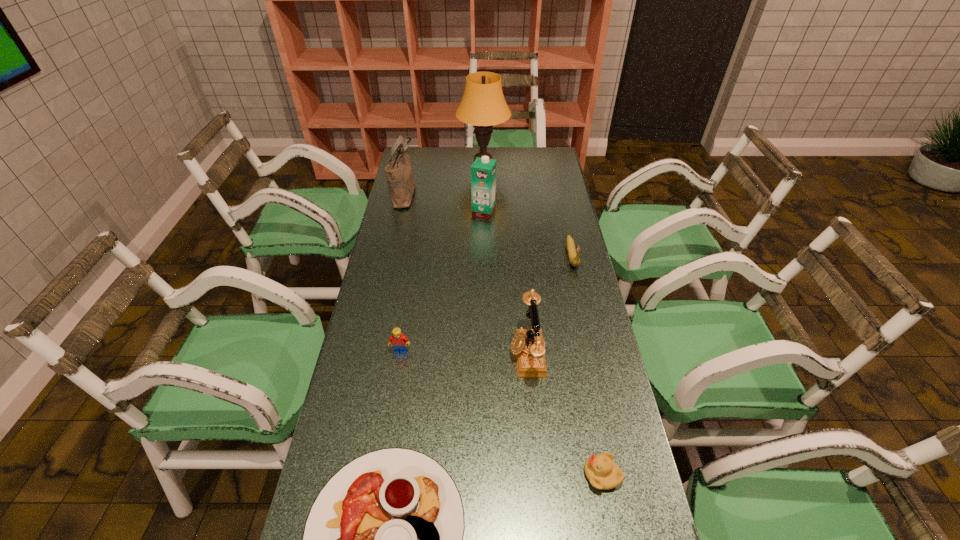
Locate an element on the screen. This screenshot has height=540, width=960. free space between the telephone and the Lego is located at coordinates pos(464,352).

This screenshot has height=540, width=960. Find the location of `free point between the telephone and the farthest object`. free point between the telephone and the farthest object is located at coordinates (505, 257).

Locate an element on the screen. empty space between the tallest object and the banana is located at coordinates (527, 208).

The height and width of the screenshot is (540, 960). Find the location of `object that is the closest to the Lego`. object that is the closest to the Lego is located at coordinates (527, 344).

Select which object appears as the fourth closest to the farthest object. Please provide its 2D coordinates. Your answer should be formatted as a tuple, i.e. [(x, y)], where the tuple contains the x and y coordinates of a point satisfying the conditions above.

[(527, 344)]

Locate an element on the screen. The width and height of the screenshot is (960, 540). free space in the image that satisfies the following two spatial constraints: 1. on the back side of the carton; 2. on the front-facing side of the shoulder bag is located at coordinates (x=484, y=194).